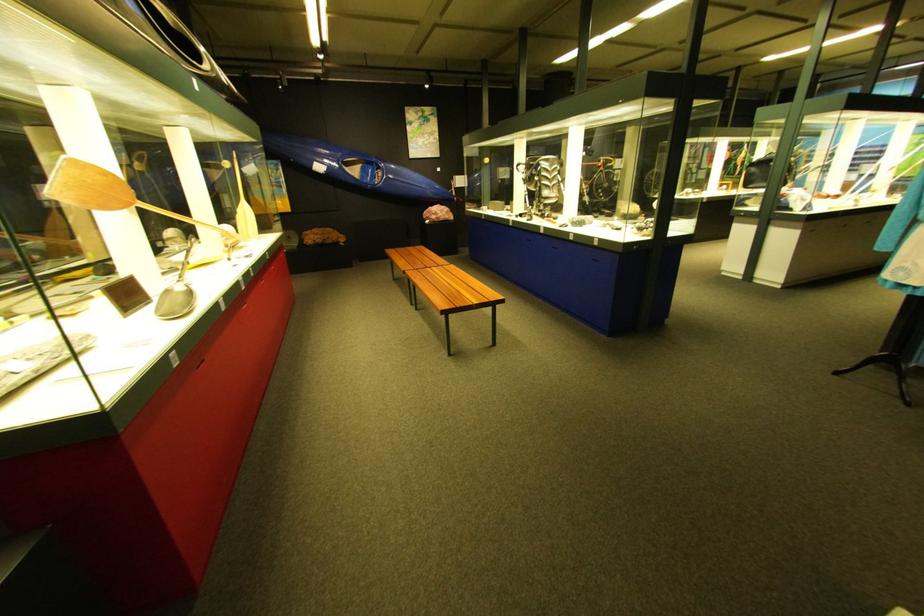
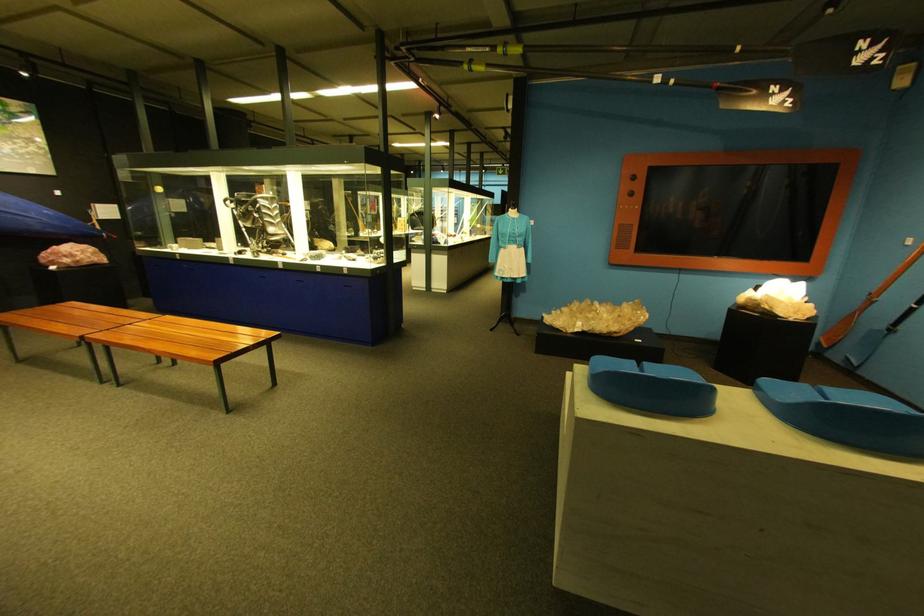
Question: The first image is from the beginning of the video and the second image is from the end. How did the camera likely rotate when shooting the video?

Choices:
 (A) Left
 (B) Right
 (C) Up
 (D) Down

Answer: (B)